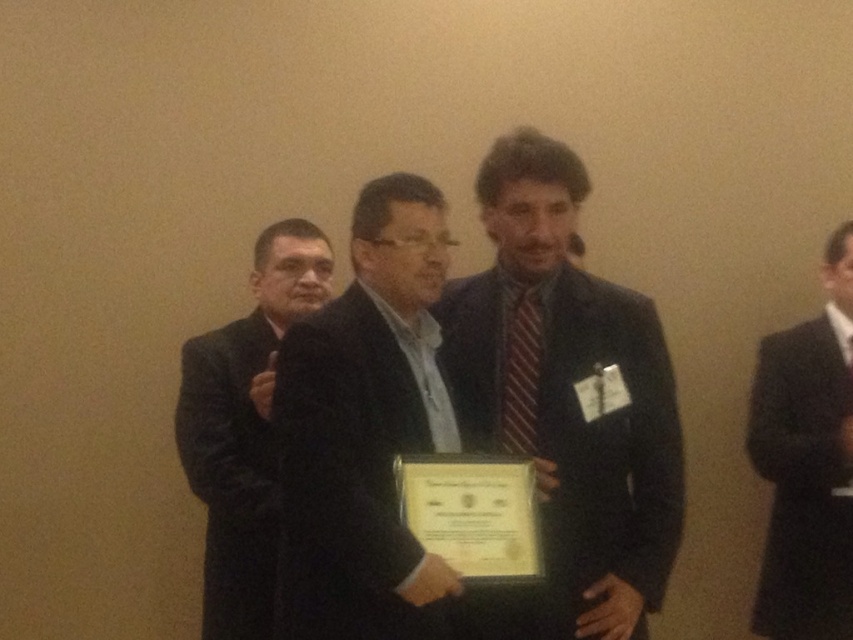
Question: Can you confirm if black matte suit at left is thinner than black suit at right?

Choices:
 (A) yes
 (B) no

Answer: (B)

Question: Which of the following is the farthest from the observer?

Choices:
 (A) black matte suit at left
 (B) black suit at right
 (C) dark suit at center
 (D) striped fabric tie at center

Answer: (B)

Question: Can you confirm if black matte suit at center is bigger than black matte suit at left?

Choices:
 (A) no
 (B) yes

Answer: (A)

Question: Which object is the farthest from the black suit at right?

Choices:
 (A) striped fabric tie at center
 (B) black matte suit at center
 (C) black matte suit at left

Answer: (C)

Question: Does black matte suit at center have a greater width compared to black suit at right?

Choices:
 (A) yes
 (B) no

Answer: (A)

Question: Which object is positioned farthest from the dark suit at center?

Choices:
 (A) black matte suit at left
 (B) black suit at right

Answer: (B)